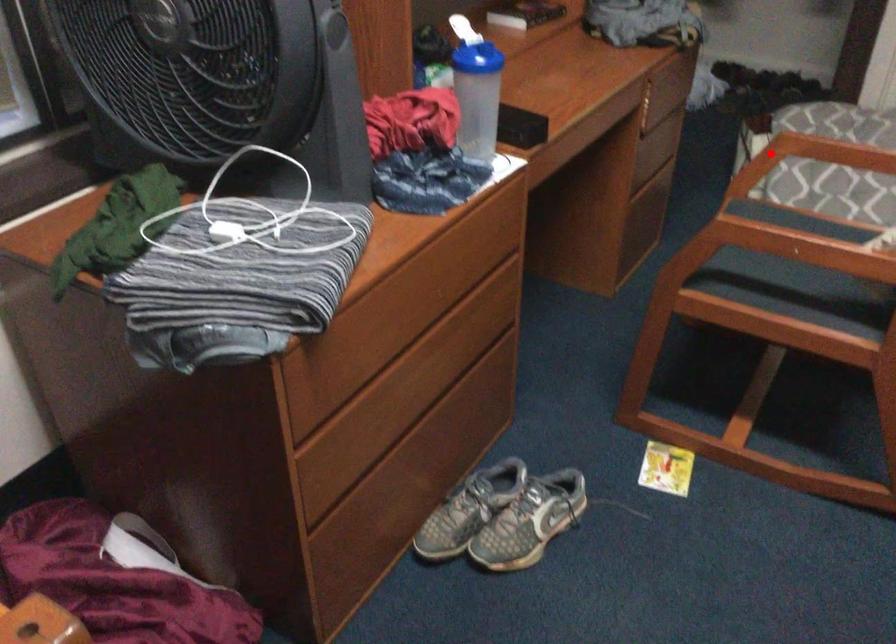
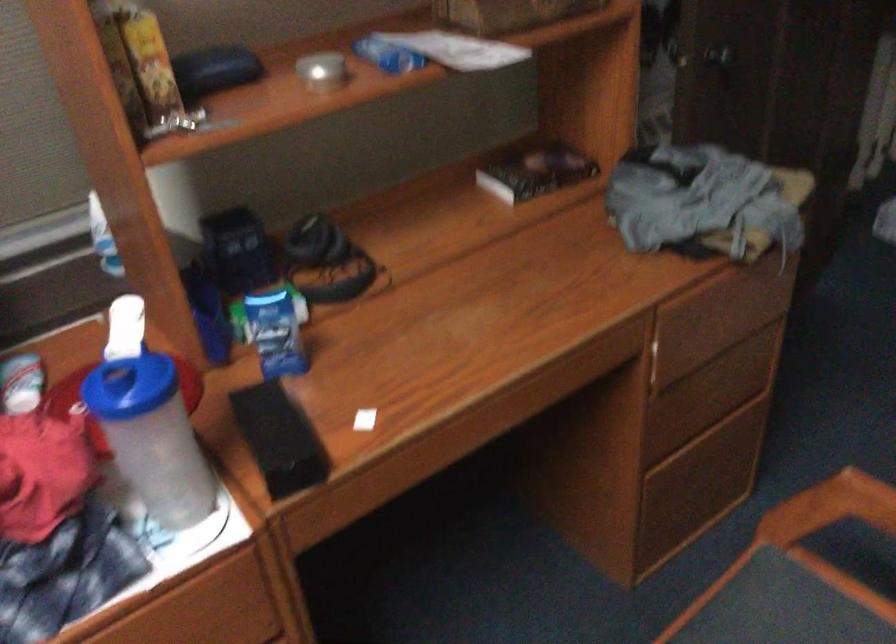
Question: I am providing you with two images of the same scene from different viewpoints. Given a red point in image1, look at the same physical point in image2. Is it:

Choices:
 (A) Closer to the viewpoint
 (B) Farther from the viewpoint

Answer: (A)